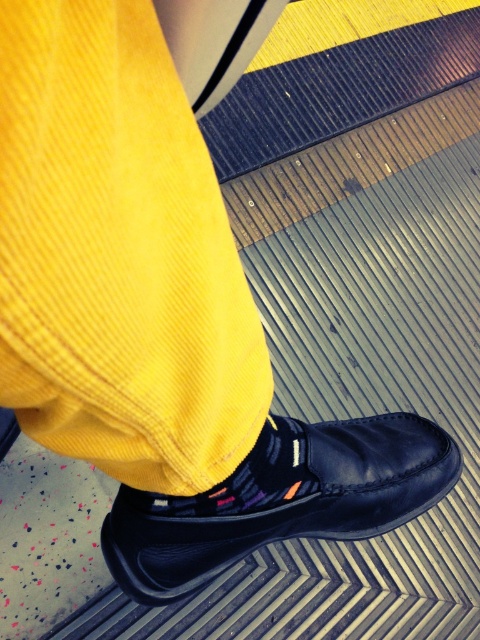
Looking at this image, you are a photographer standing 30 inches away from the textured surface in the image. You want to capture a closeup of the point at coordinates point (130, 545). Will you need to move closer or farther away to ensure the point is in focus?

The distance of point (130, 545) from viewer is 26.26 inches. Since you are currently 30 inches away, you need to move closer by approximately 3.74 inches to be at the correct distance for the point to be in focus.

You are a photographer trying to capture the black leather shoe at lower center in the center of your camera frame. The camera has a crosshair at position 0.5, 0.5. What direction should you move the camera to align the shoe with the crosshair?

The black leather shoe at lower center is located at coordinates (280, 499). To center it in the frame with the crosshair at (240, 320), you should move the camera to the left and slightly upward. This adjustment will bring the shoe closer to the center coordinates.

You are standing on a train platform and see a person wearing bright yellow trousers. They have a black leather shoe at lower center and a multicolored knit sock at center. Which object is positioned to the right of the other?

The black leather shoe at lower center is positioned to the right of the multicolored knit sock at center.